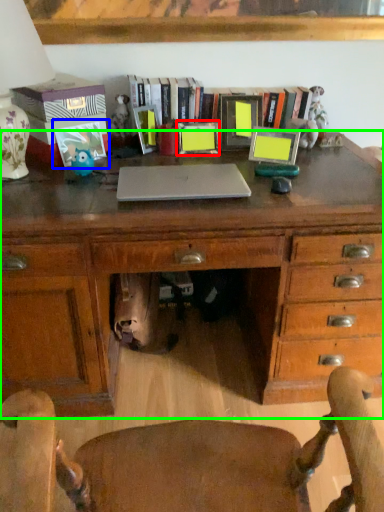
Question: Which object is positioned closest to picture frame (highlighted by a red box)? Select from picture frame (highlighted by a blue box) and desk (highlighted by a green box).

Choices:
 (A) picture frame
 (B) desk

Answer: (A)